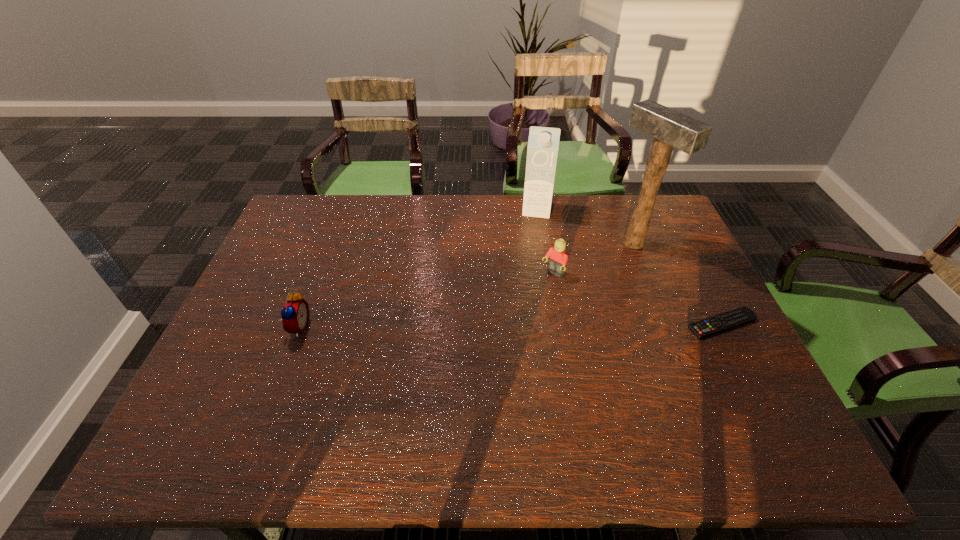
The width and height of the screenshot is (960, 540). Identify the location of free spot on the desktop that is between the leftmost object and the shortest object and is positioned on the front label of the farthest object. (521, 326).

Find the location of a particular element. This screenshot has height=540, width=960. vacant spot on the desktop that is between the alarm clock and the shortest object and is positioned on the striking surface of the tallest object is located at coordinates (472, 326).

At what (x,y) coordinates should I click in order to perform the action: click on free space on the desktop that is between the alarm clock and the shortest object and is positioned on the face of the Lego. Please return your answer as a coordinate pair (x, y). Looking at the image, I should click on (500, 326).